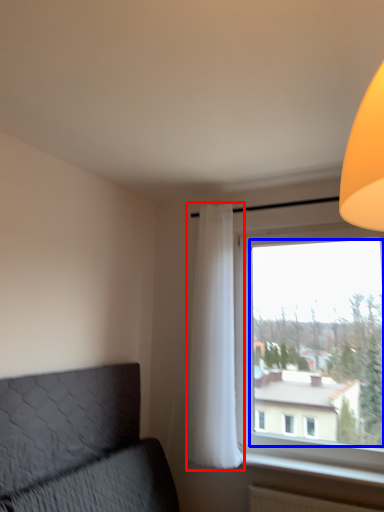
Question: Which object appears closest to the camera in this image, curtain (highlighted by a red box) or window screen (highlighted by a blue box)?

Choices:
 (A) curtain
 (B) window screen

Answer: (B)